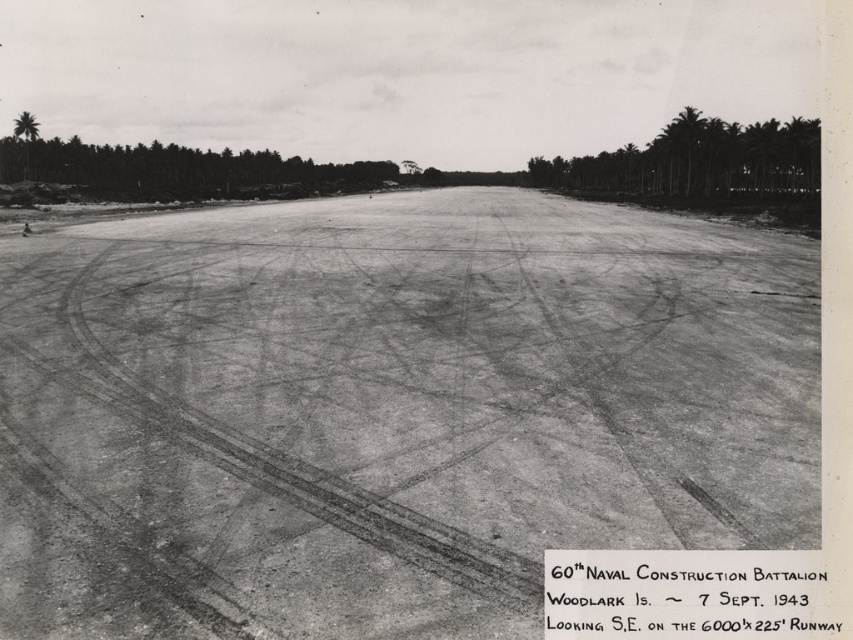
Question: Estimate the real-world distances between objects in this image. Which object is farther from the green leafy trees at upper right?

Choices:
 (A) dirt at center
 (B) green leafy palm tree at upper left

Answer: (B)

Question: Which is farther from the green leafy trees at upper right?

Choices:
 (A) green leafy palm tree at upper left
 (B) dirt at center

Answer: (A)

Question: Is dirt at center above green leafy trees at upper right?

Choices:
 (A) yes
 (B) no

Answer: (B)

Question: Does dirt at center lie behind green leafy trees at upper right?

Choices:
 (A) no
 (B) yes

Answer: (A)

Question: Is dirt at center to the right of green leafy trees at upper right from the viewer's perspective?

Choices:
 (A) yes
 (B) no

Answer: (B)

Question: Which point is closer to the camera?

Choices:
 (A) green leafy palm tree at upper left
 (B) green leafy trees at upper right

Answer: (B)